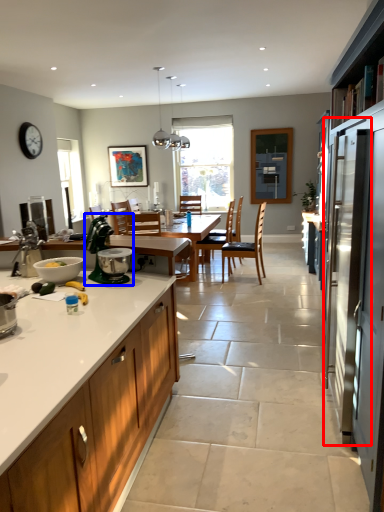
Question: Which object appears farthest to the camera in this image, screen door (highlighted by a red box) or appliance (highlighted by a blue box)?

Choices:
 (A) screen door
 (B) appliance

Answer: (B)